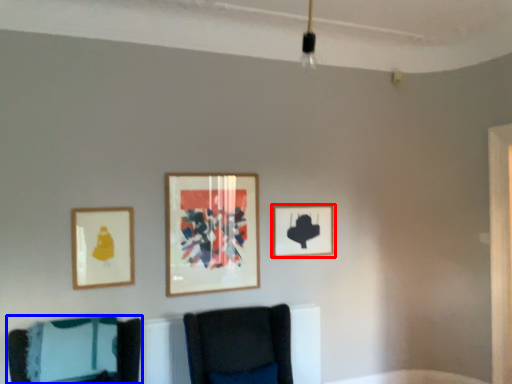
Question: Among these objects, which one is farthest to the camera, picture frame (highlighted by a red box) or furniture (highlighted by a blue box)?

Choices:
 (A) picture frame
 (B) furniture

Answer: (A)